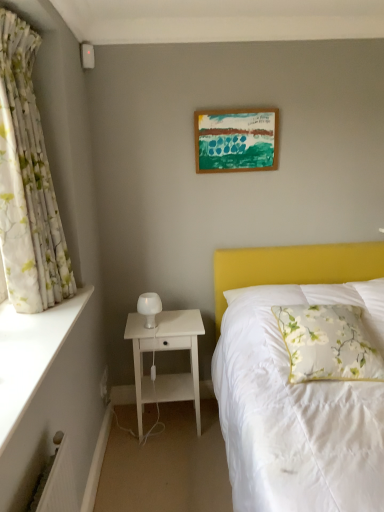
Question: Does point (155, 297) appear closer or farther from the camera than point (18, 336)?

Choices:
 (A) closer
 (B) farther

Answer: (B)

Question: Is white frosted glass table lamp at left to the left or to the right of white smooth ledge at left in the image?

Choices:
 (A) right
 (B) left

Answer: (A)

Question: Which of these objects is positioned farthest from the white wood nightstand at lower left?

Choices:
 (A) white frosted glass table lamp at left
 (B) wooden picture frame at upper center
 (C) white floral fabric curtain at left
 (D) floral fabric pillow at right
 (E) white smooth ledge at left

Answer: (B)

Question: Considering the real-world distances, which object is closest to the white floral fabric curtain at left?

Choices:
 (A) white frosted glass table lamp at left
 (B) white smooth ledge at left
 (C) white wood nightstand at lower left
 (D) wooden picture frame at upper center
 (E) floral fabric pillow at right

Answer: (B)